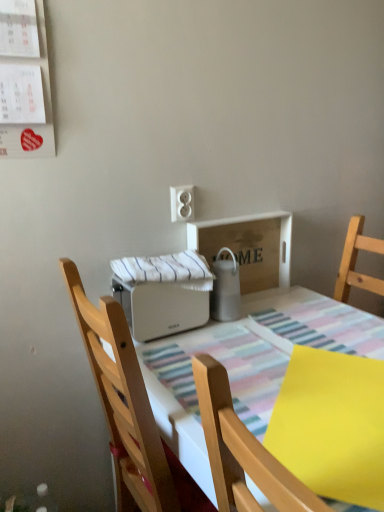
Where is `vacant space behind yellow matte paper at lower right`? vacant space behind yellow matte paper at lower right is located at coordinates (282, 340).